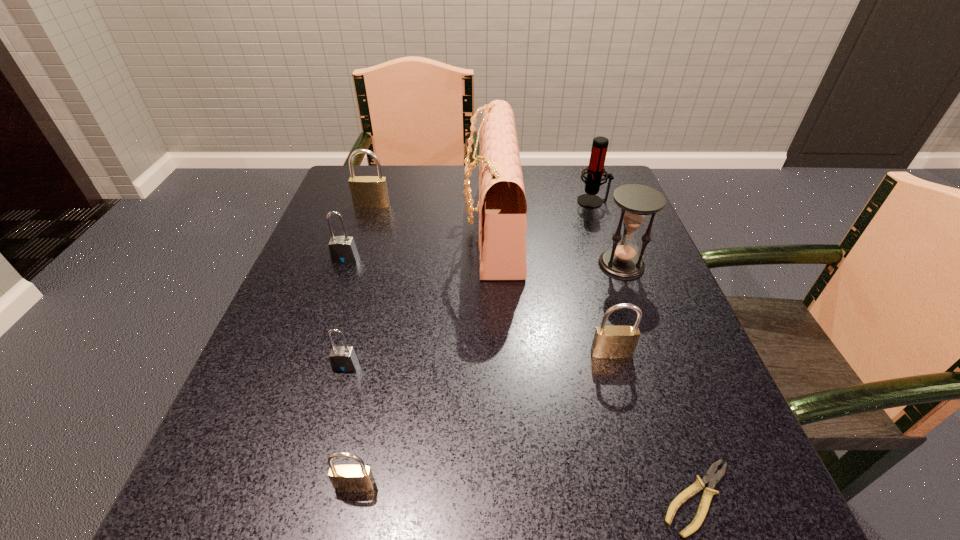
Find the location of a particular element. This screenshot has height=540, width=960. the right gray padlock is located at coordinates (342, 358).

Find the location of a particular element. The width and height of the screenshot is (960, 540). the smaller gray padlock is located at coordinates (342, 358).

Where is `the smallest brass padlock`? Image resolution: width=960 pixels, height=540 pixels. the smallest brass padlock is located at coordinates (346, 478).

Find the location of a particular element. The width and height of the screenshot is (960, 540). the second brass padlock from right to left is located at coordinates coord(346,478).

In order to click on yellow pliers in this screenshot , I will do `click(712, 479)`.

Find the location of a particular element. This screenshot has width=960, height=540. pliers is located at coordinates (712, 479).

Find the location of a particular element. The width and height of the screenshot is (960, 540). free space located on the front-facing side of the fifth object from right to left is located at coordinates (378, 228).

Where is `blank space located on the front-facing side of the fifth object from right to left`? The width and height of the screenshot is (960, 540). blank space located on the front-facing side of the fifth object from right to left is located at coordinates (362, 228).

This screenshot has height=540, width=960. I want to click on free location located on the front-facing side of the fifth object from right to left, so click(421, 228).

Locate an element on the screen. free space located on the left of the red microphone is located at coordinates (422, 201).